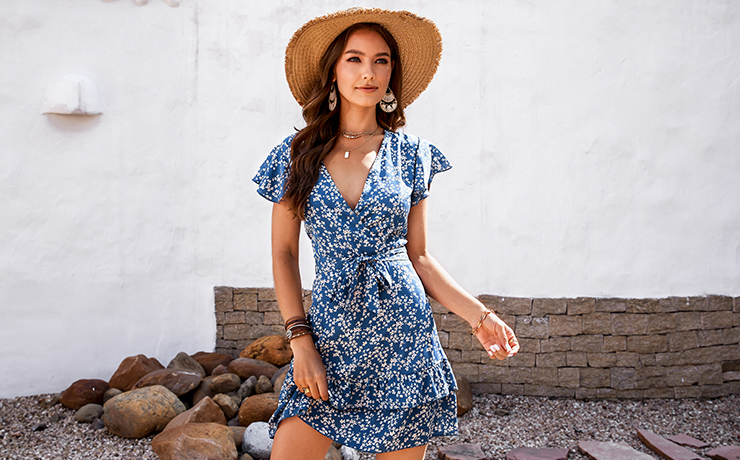
The width and height of the screenshot is (740, 460). Identify the location of white plaster wall. (43, 242), (235, 52), (585, 130).